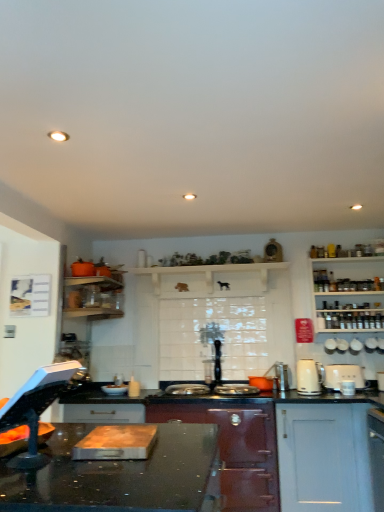
Question: Can you confirm if orange matte pot at center, placed as the 1th appliance when sorted from left to right, is positioned to the right of white plastic toaster at right, which is the second kitchen appliance in left-to-right order?

Choices:
 (A) yes
 (B) no

Answer: (B)

Question: Can you confirm if orange matte pot at center, placed as the 1th appliance when sorted from left to right, is positioned to the left of white plastic toaster at right, which is the second kitchen appliance in left-to-right order?

Choices:
 (A) yes
 (B) no

Answer: (A)

Question: From the image's perspective, is orange matte pot at center, placed as the 1th appliance when sorted from left to right, under white plastic toaster at right, which is the second kitchen appliance in left-to-right order?

Choices:
 (A) no
 (B) yes

Answer: (B)

Question: From a real-world perspective, is orange matte pot at center, positioned as the fifth appliance in right-to-left order, on white plastic toaster at right, the first kitchen appliance viewed from the right?

Choices:
 (A) yes
 (B) no

Answer: (B)

Question: Could you tell me if orange matte pot at center, placed as the 1th appliance when sorted from left to right, is facing white plastic toaster at right, which is the second kitchen appliance in left-to-right order?

Choices:
 (A) yes
 (B) no

Answer: (B)

Question: Is orange matte pot at center, positioned as the fifth appliance in right-to-left order, looking in the opposite direction of white plastic toaster at right, which is the second kitchen appliance in left-to-right order?

Choices:
 (A) no
 (B) yes

Answer: (A)

Question: Does white matte cabinet at lower right, the 2th cabinetry viewed from the left, appear on the right side of white ceramic toaster at upper right, placed as the third appliance when sorted from left to right?

Choices:
 (A) yes
 (B) no

Answer: (B)

Question: Is white matte cabinet at lower right, the 2th cabinetry viewed from the left, aimed at white ceramic toaster at upper right, arranged as the third appliance when viewed from the right?

Choices:
 (A) yes
 (B) no

Answer: (B)

Question: Is white matte cabinet at lower right, the 2th cabinetry viewed from the left, to the left of white ceramic toaster at upper right, placed as the third appliance when sorted from left to right, from the viewer's perspective?

Choices:
 (A) yes
 (B) no

Answer: (A)

Question: Does white matte cabinet at lower right, the first cabinetry from the right, have a lesser width compared to white ceramic toaster at upper right, arranged as the third appliance when viewed from the right?

Choices:
 (A) yes
 (B) no

Answer: (B)

Question: Are white matte cabinet at lower right, the first cabinetry from the right, and white ceramic toaster at upper right, arranged as the third appliance when viewed from the right, making contact?

Choices:
 (A) no
 (B) yes

Answer: (A)

Question: Is white matte cabinet at lower right, the first cabinetry from the right, not within white ceramic toaster at upper right, placed as the third appliance when sorted from left to right?

Choices:
 (A) no
 (B) yes

Answer: (B)

Question: Is matte dark red stove at center, the second cabinetry viewed from the right, facing towards black glossy countertop at center?

Choices:
 (A) no
 (B) yes

Answer: (B)